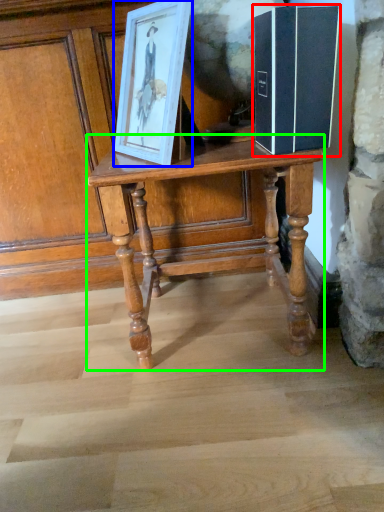
Question: Which is nearer to the book (highlighted by a red box)? picture frame (highlighted by a blue box) or table (highlighted by a green box).

Choices:
 (A) picture frame
 (B) table

Answer: (A)